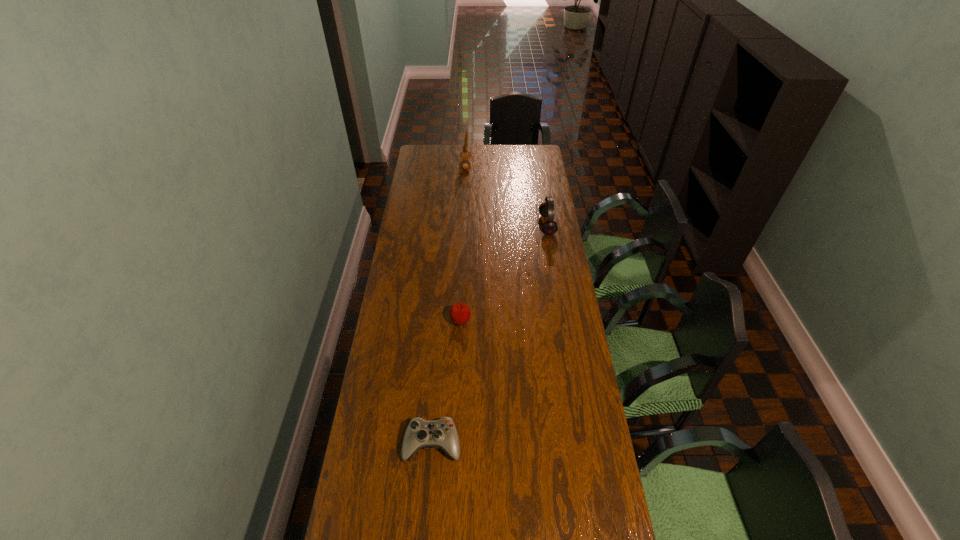
Where is `vacant region between the third nearest object and the farthest object`? vacant region between the third nearest object and the farthest object is located at coordinates (506, 195).

Image resolution: width=960 pixels, height=540 pixels. I want to click on free spot between the apple and the control, so click(446, 382).

Where is `vacant space that's between the rightmost object and the shortest object`? vacant space that's between the rightmost object and the shortest object is located at coordinates (490, 334).

Where is `free spot between the farthest object and the third farthest object`? free spot between the farthest object and the third farthest object is located at coordinates (463, 243).

You are a GUI agent. You are given a task and a screenshot of the screen. Output one action in this format:
    pyautogui.click(x=<x>, y=<y>)
    Task: Click on the unoccupied area between the farther earphone and the shortest object
    Image resolution: width=960 pixels, height=540 pixels.
    Given the screenshot: What is the action you would take?
    pyautogui.click(x=449, y=304)

Find the location of a particular element. free spot between the third farthest object and the farthest object is located at coordinates (463, 243).

The width and height of the screenshot is (960, 540). What are the coordinates of `free area in between the second nearest object and the rightmost object` in the screenshot? It's located at (504, 273).

This screenshot has width=960, height=540. Identify the location of free spot between the farther earphone and the control. (449, 304).

Identify the location of vacant area that lies between the third shortest object and the nearest object. Image resolution: width=960 pixels, height=540 pixels. (490, 334).

Find the location of a particular element. object that can be found as the third closest to the taller earphone is located at coordinates (420, 433).